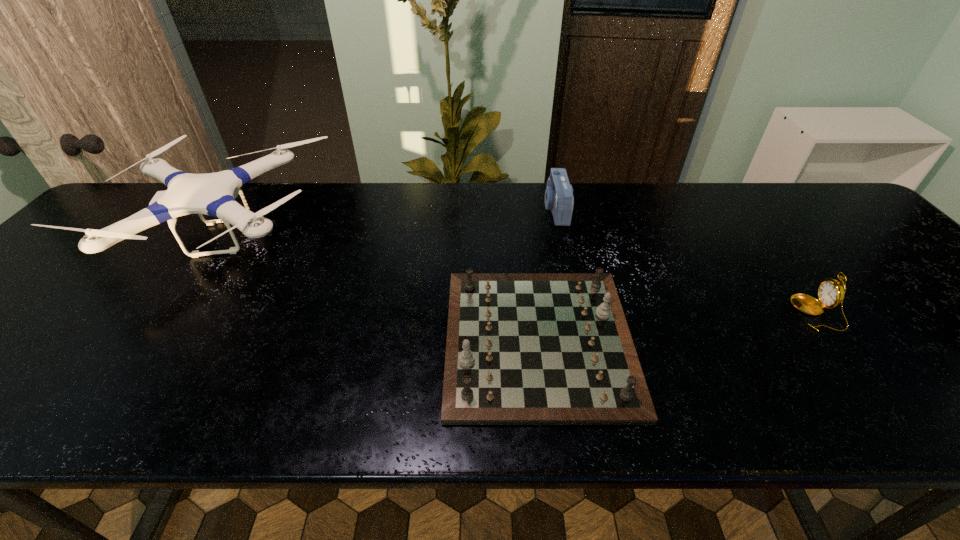
At what (x,y) coordinates should I click in order to perform the action: click on free spot between the camera and the leftmost object. Please return your answer as a coordinate pair (x, y). Image resolution: width=960 pixels, height=540 pixels. Looking at the image, I should click on (389, 222).

You are a GUI agent. You are given a task and a screenshot of the screen. Output one action in this format:
    pyautogui.click(x=<x>, y=<y>)
    Task: Click on the vacant area between the leftmost object and the camera
    
    Given the screenshot: What is the action you would take?
    389,222

Where is `vacant area that lies between the shortest object and the drone`? This screenshot has width=960, height=540. vacant area that lies between the shortest object and the drone is located at coordinates (380, 288).

I want to click on object that is the second nearest to the camera, so click(831, 293).

Where is `object that is the third nearest to the pocket watch`? The height and width of the screenshot is (540, 960). object that is the third nearest to the pocket watch is located at coordinates (213, 194).